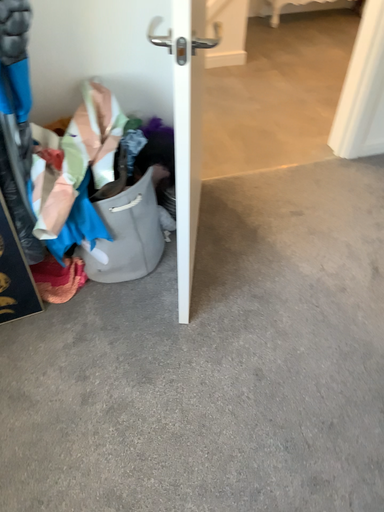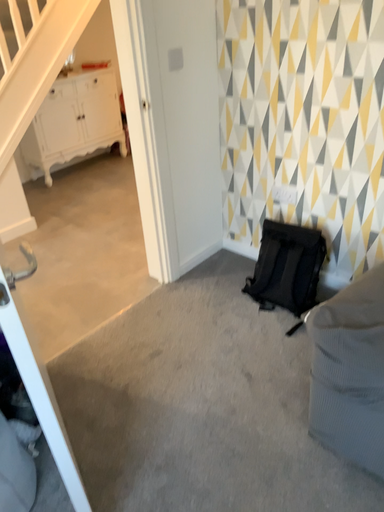
Question: How did the camera likely rotate when shooting the video?

Choices:
 (A) rotated downward
 (B) rotated upward

Answer: (B)